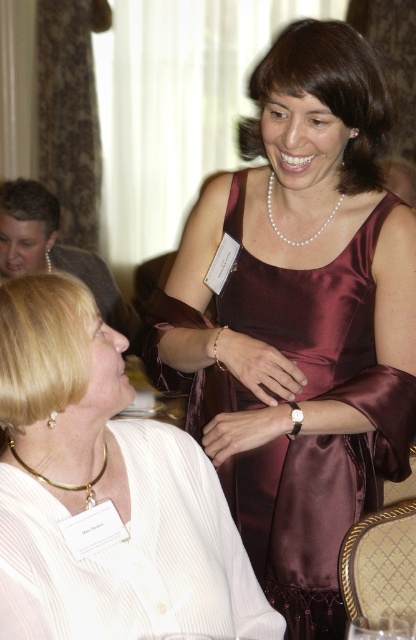
You are at the event and want to find the burgundy satin dress at center. Where is it located in terms of coordinates?

The burgundy satin dress at center is located at coordinates (299, 321).

You are at the formal event and want to move from the point at coordinates point (353, 237) to the point at coordinates point (322, 225). Since you can only move forward, will you be able to reach the second point without moving sideways or backward?

Yes, because point (353, 237) is in front of point (322, 225), so moving forward from the first point will lead you towards the second point.

You are at a formal event and notice two necklaces on the same person. The first is a matte gold necklace at upper left, and the second is a gold chain necklace at lower left. Which necklace is closer to you?

The matte gold necklace at upper left is closer to you because it is further to the viewer than the gold chain necklace at lower left.